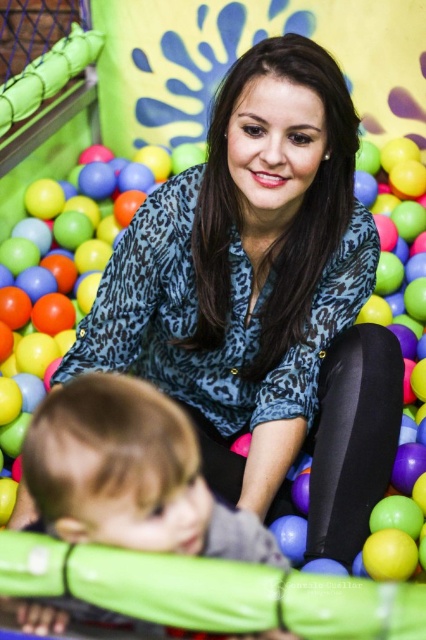
Question: Which object is positioned closest to the matte plastic ball at center?

Choices:
 (A) leopard print blouse at center
 (B) blonde hair toddler at center

Answer: (A)

Question: Is blonde hair toddler at center closer to the viewer compared to matte plastic ball at center?

Choices:
 (A) yes
 (B) no

Answer: (A)

Question: Can you confirm if blonde hair toddler at center is positioned below matte plastic ball at center?

Choices:
 (A) yes
 (B) no

Answer: (A)

Question: Which point is closer to the camera taking this photo?

Choices:
 (A) (106, 298)
 (B) (108, 497)

Answer: (B)

Question: Which object is positioned farthest from the matte plastic ball at center?

Choices:
 (A) blonde hair toddler at center
 (B) leopard print blouse at center

Answer: (A)

Question: Observing the image, what is the correct spatial positioning of leopard print blouse at center in reference to blonde hair toddler at center?

Choices:
 (A) above
 (B) below

Answer: (A)